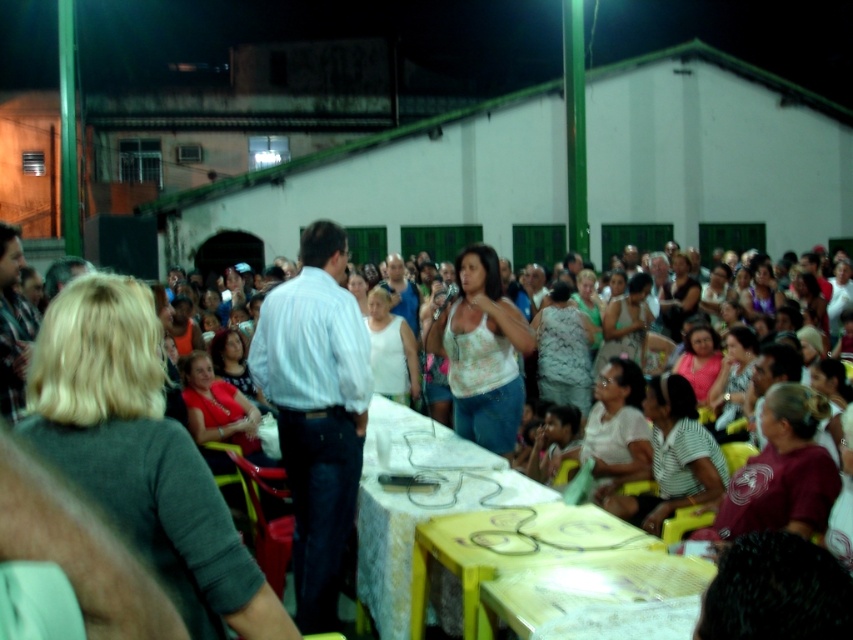
Is white cotton shirt at center closer to camera compared to yellow glossy table at center?

Yes, it is.

Is point (51, 388) farther from viewer compared to point (543, 513)?

No, (51, 388) is in front of (543, 513).

Between point (68, 305) and point (511, 545), which one is positioned behind?

Positioned behind is point (511, 545).

The image size is (853, 640). Identify the location of white cotton shirt at center. (141, 456).

Between point (289, 467) and point (659, 577), which one is positioned in front?

Point (659, 577)

The width and height of the screenshot is (853, 640). Identify the location of white shirt at center. (316, 412).

Can you confirm if yellow plastic table at center is taller than wooden table at lower center?

Indeed, yellow plastic table at center has a greater height compared to wooden table at lower center.

Who is lower down, yellow plastic table at center or wooden table at lower center?

wooden table at lower center is below.

Where is `yellow plastic table at center`? The height and width of the screenshot is (640, 853). yellow plastic table at center is located at coordinates (419, 502).

You are a GUI agent. You are given a task and a screenshot of the screen. Output one action in this format:
    pyautogui.click(x=<x>, y=<y>)
    Task: Click on the yellow plastic table at center
    The image size is (853, 640).
    Given the screenshot: What is the action you would take?
    pyautogui.click(x=419, y=502)